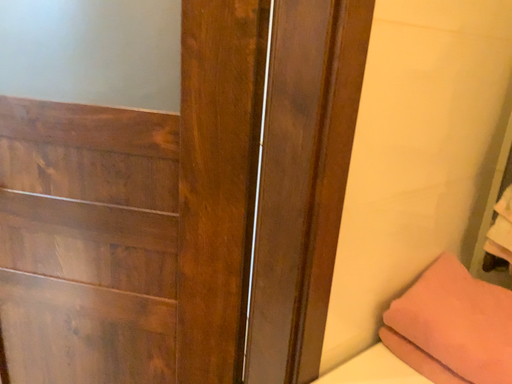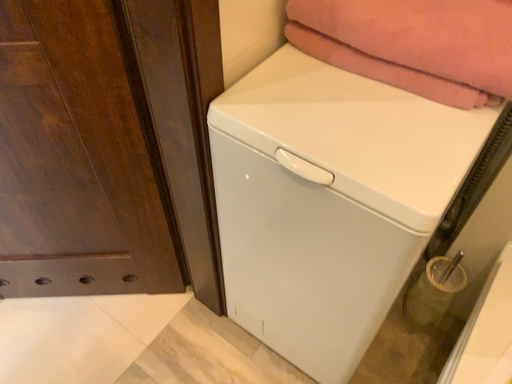
Question: How did the camera likely rotate when shooting the video?

Choices:
 (A) rotated left
 (B) rotated right

Answer: (B)